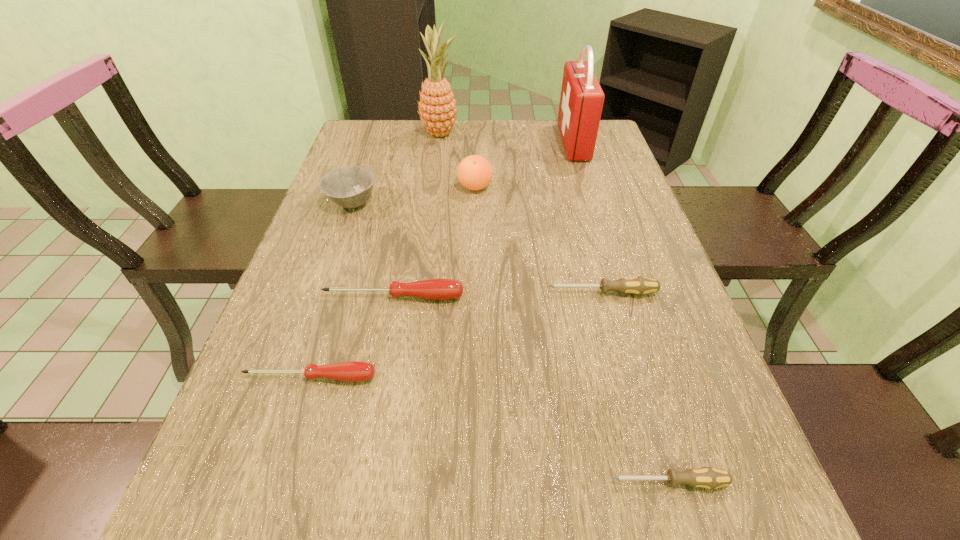
Locate an element on the screen. free space located at the tip of the farther gray screwdriver is located at coordinates (518, 293).

The height and width of the screenshot is (540, 960). Find the location of `vacant space located 0.060m at the tip of the farther gray screwdriver`. vacant space located 0.060m at the tip of the farther gray screwdriver is located at coordinates (518, 293).

Image resolution: width=960 pixels, height=540 pixels. What are the coordinates of `vacant space located on the right of the smaller red screwdriver` in the screenshot? It's located at (404, 377).

You are a GUI agent. You are given a task and a screenshot of the screen. Output one action in this format:
    pyautogui.click(x=<x>, y=<y>)
    Task: Click on the vacant space situated 0.180m at the tip of the smaller gray screwdriver
    
    Given the screenshot: What is the action you would take?
    pyautogui.click(x=492, y=482)

Locate an element on the screen. vacant space situated at the tip of the smaller gray screwdriver is located at coordinates (459, 482).

Locate an element on the screen. The width and height of the screenshot is (960, 540). free space located at the tip of the smaller gray screwdriver is located at coordinates (459, 482).

Where is `pineapple located in the far edge section of the desktop`? pineapple located in the far edge section of the desktop is located at coordinates (437, 107).

Image resolution: width=960 pixels, height=540 pixels. Find the location of `the first-aid kit that is at the far edge`. the first-aid kit that is at the far edge is located at coordinates (581, 101).

Identify the location of bowl at the left edge. The width and height of the screenshot is (960, 540). (350, 186).

Locate an element on the screen. The width and height of the screenshot is (960, 540). the first-aid kit that is at the right edge is located at coordinates (581, 101).